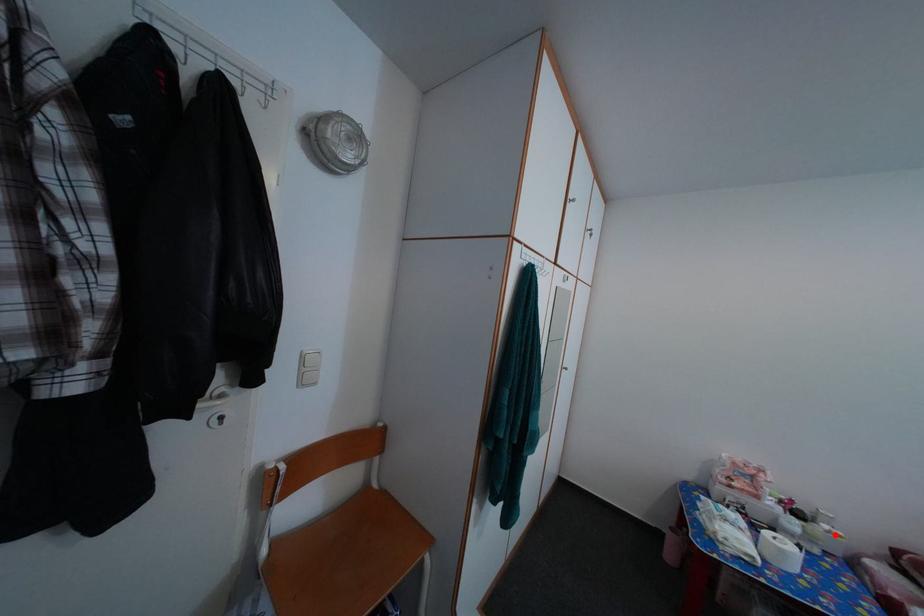
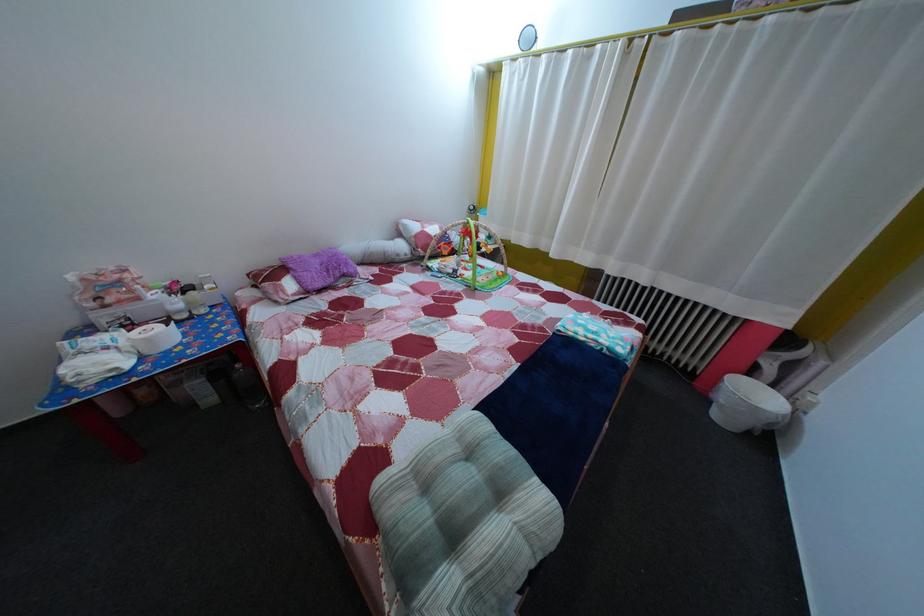
Where in the second image is the point corresponding to the highlighted location from the first image?

(216, 294)